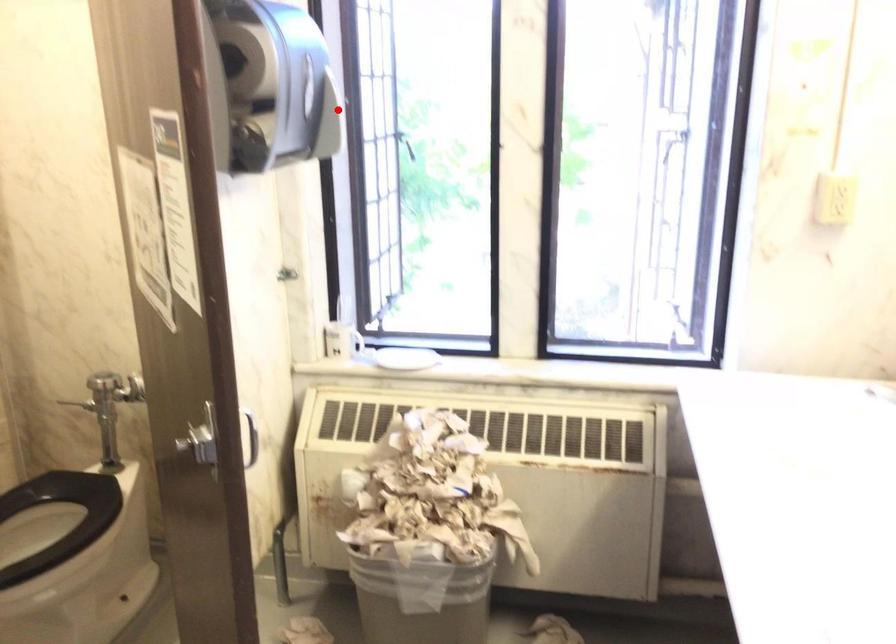
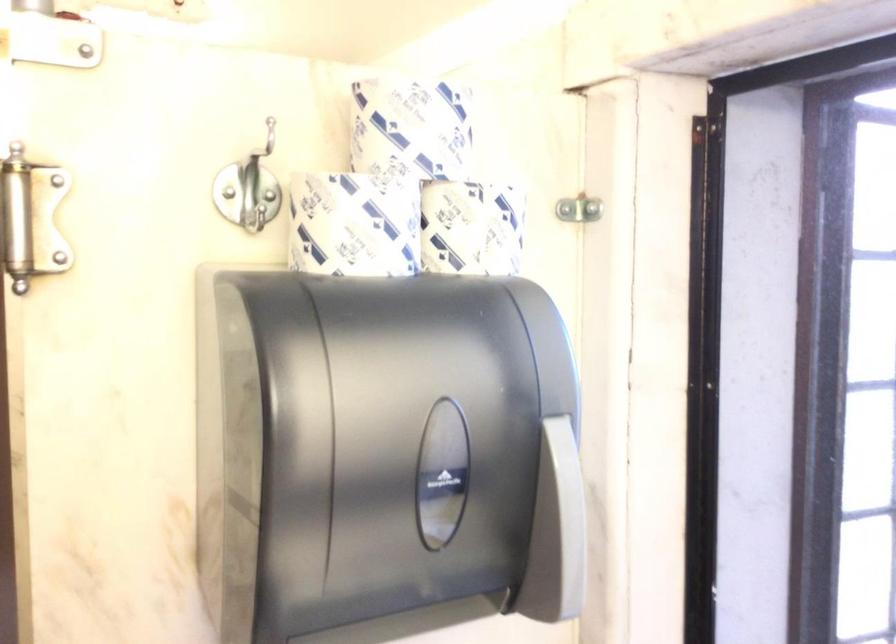
Question: I am providing you with two images of the same scene from different viewpoints. A red point is marked on the first image. Can you still see the location of the red point in image 2?

Choices:
 (A) Yes
 (B) No

Answer: (A)